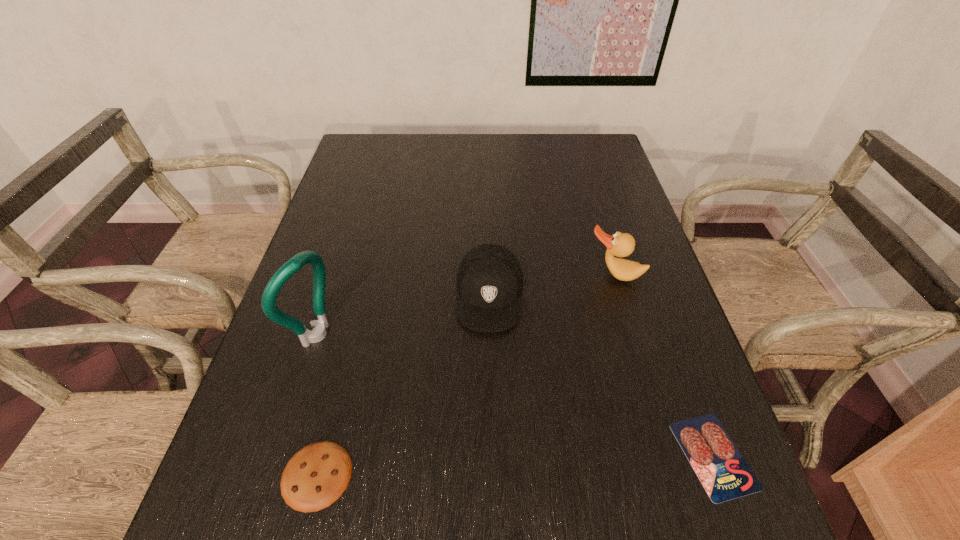
At what (x,y) coordinates should I click in order to perform the action: click on free space on the desktop that is between the cookie and the shortest object and is positioned at the jaws of the bottle opener. Please return your answer as a coordinate pair (x, y). The width and height of the screenshot is (960, 540). Looking at the image, I should click on (561, 463).

Locate an element on the screen. vacant space on the desktop that is between the fourth tallest object and the salami and is positioned on the front-facing side of the third object from left to right is located at coordinates (477, 467).

At what (x,y) coordinates should I click in order to perform the action: click on vacant space on the desktop that is between the fourth tallest object and the shortest object and is positioned on the beak of the duck. Please return your answer as a coordinate pair (x, y). Looking at the image, I should click on pyautogui.click(x=564, y=463).